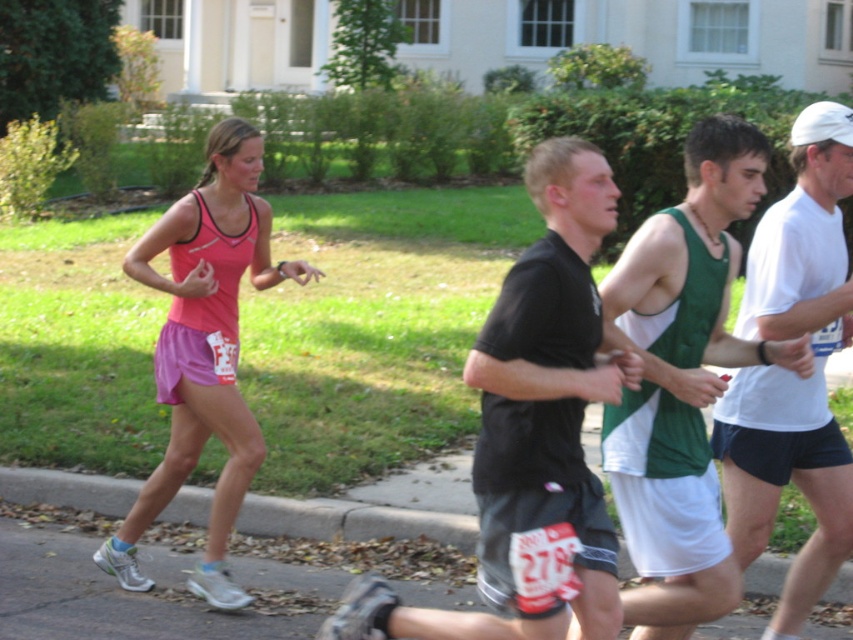
Which is below, green tank top at center or white matte shorts at right?

Positioned lower is white matte shorts at right.

Between point (715, 253) and point (807, 540), which one is positioned in front?

Point (715, 253) is in front.

Which is behind, point (654, 320) or point (825, 456)?

Point (825, 456)

Find the location of a particular element. This screenshot has height=640, width=853. green tank top at center is located at coordinates (682, 378).

Is point (807, 221) positioned after point (469, 548)?

No, (807, 221) is closer to viewer.

The height and width of the screenshot is (640, 853). Find the location of `white matte shorts at right`. white matte shorts at right is located at coordinates (788, 371).

Locate an element on the screen. The image size is (853, 640). white matte shorts at right is located at coordinates (788, 371).

Which is behind, point (505, 388) or point (650, 387)?

Positioned behind is point (650, 387).

You are a GUI agent. You are given a task and a screenshot of the screen. Output one action in this format:
    pyautogui.click(x=<x>, y=<y>)
    Task: Click on the black matte shirt at center
    This screenshot has height=640, width=853.
    Given the screenshot: What is the action you would take?
    pyautogui.click(x=532, y=432)